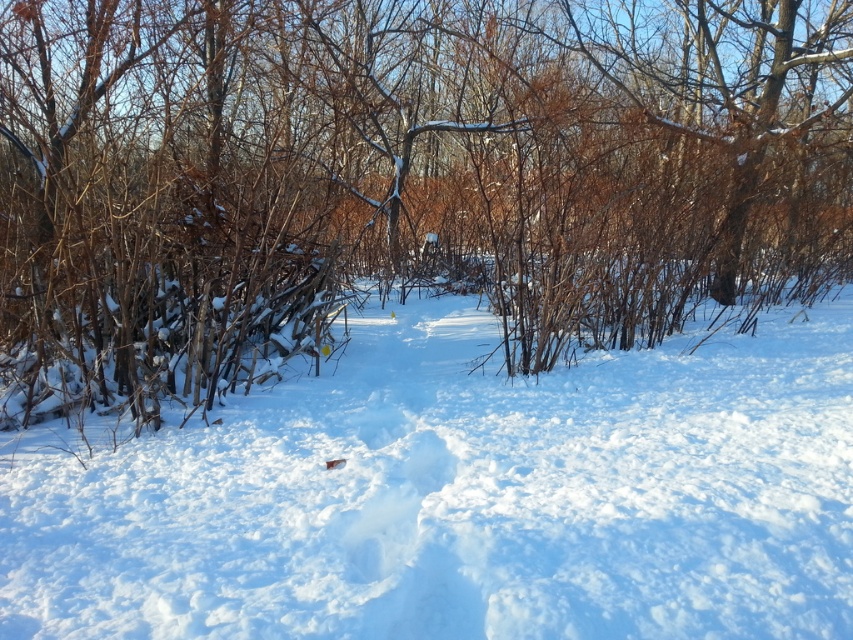
You are standing at the edge of the snowy path in the winter scene. You see a point marked at coordinates (399, 177). What object is located at that point?

The point at coordinates (399, 177) indicates a brown wood at center.

You are standing at the edge of the winter woods and see the brown wood at center. If you want to walk directly towards it, which direction should you move?

Since the brown wood at center is located at coordinates approximately 0.278 on the x axis and 0.470 on the y axis, you should move towards the center of the frame where the coordinates are located.

You are standing in the winter woods and see two points marked on the snow. The first is at coordinates point [131,212] and the second at point [355,467]. Which point is closer to you?

Point [131,212] is further to the camera than point [355,467], so the point closer to you is point [355,467].